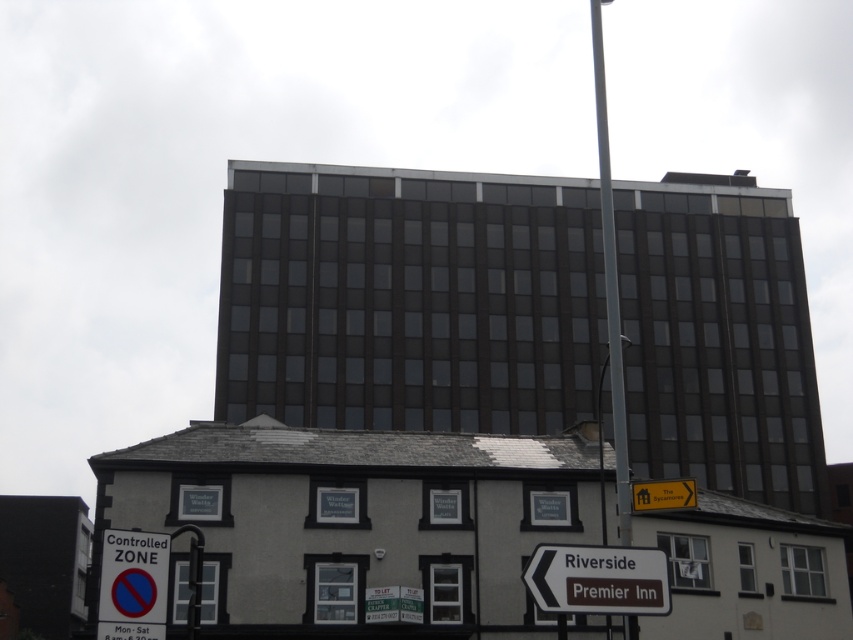
Question: Can you confirm if silver metallic pole at upper right is positioned to the right of yellow plastic sign at upper right?

Choices:
 (A) yes
 (B) no

Answer: (A)

Question: Does brown matte sign at lower center have a greater width compared to yellow plastic sign at upper right?

Choices:
 (A) yes
 (B) no

Answer: (B)

Question: Which point is farther to the camera?

Choices:
 (A) (688, 497)
 (B) (544, 547)
 (C) (160, 550)

Answer: (A)

Question: Which of the following is the closest to the observer?

Choices:
 (A) yellow plastic sign at upper right
 (B) silver metallic pole at upper right

Answer: (B)

Question: Which object is the farthest from the white plastic sign at lower left?

Choices:
 (A) yellow plastic sign at upper right
 (B) brown matte sign at lower center

Answer: (A)

Question: Is the position of brown matte sign at lower center more distant than that of yellow plastic sign at upper right?

Choices:
 (A) yes
 (B) no

Answer: (B)